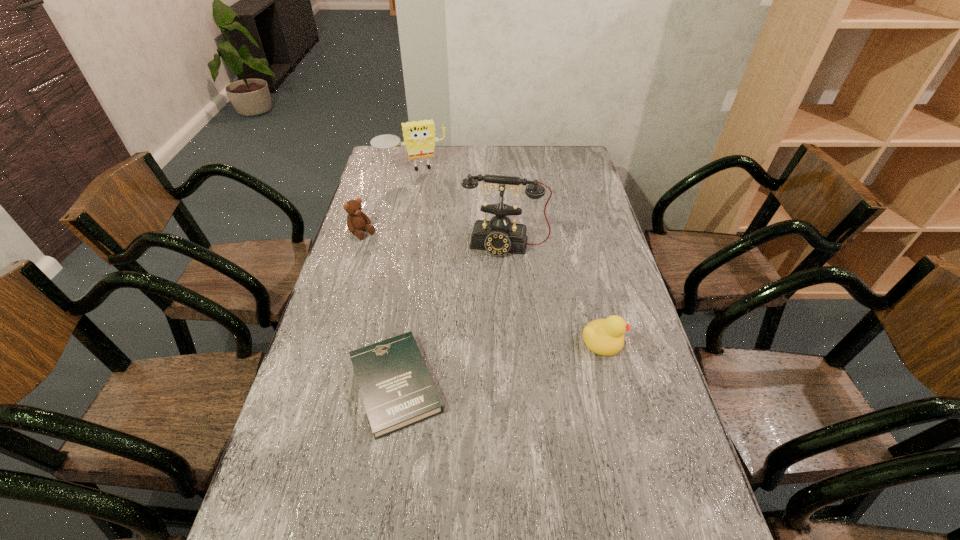
Identify the location of vacant space on the desktop that is between the book and the rightmost object and is positioned on the face of the third shortest object. (516, 359).

Locate an element on the screen. The height and width of the screenshot is (540, 960). free space on the desktop that is between the book and the second shortest object and is positioned on the front-facing side of the fourth shortest object is located at coordinates (475, 368).

Locate an element on the screen. The width and height of the screenshot is (960, 540). vacant space on the desktop that is between the book and the duckling and is positioned on the dial of the telephone is located at coordinates (483, 367).